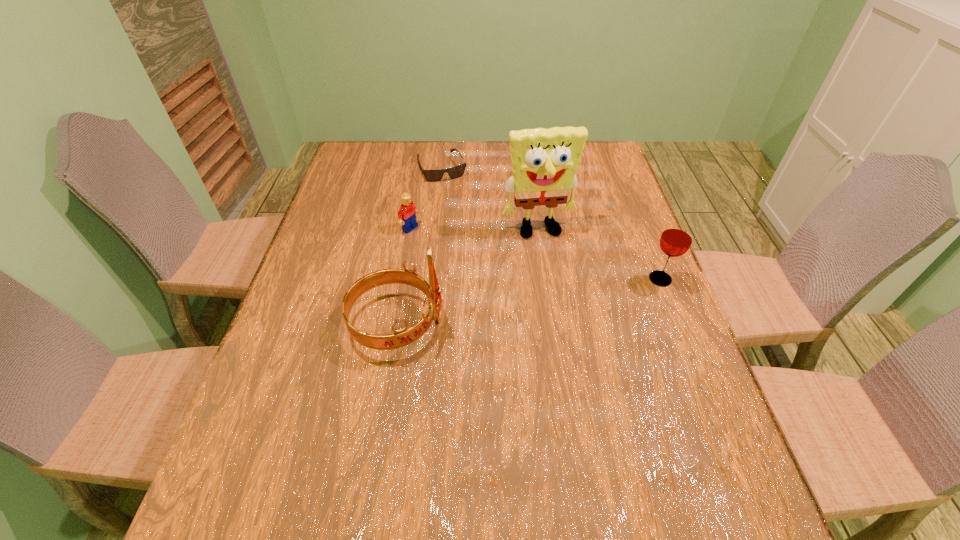
At what (x,y) coordinates should I click in order to perform the action: click on object present at the far edge. Please return your answer as a coordinate pair (x, y). The width and height of the screenshot is (960, 540). Looking at the image, I should click on (454, 172).

This screenshot has width=960, height=540. Find the location of `object that is at the left edge`. object that is at the left edge is located at coordinates (402, 337).

Find the location of a particular element. The width and height of the screenshot is (960, 540). object present at the right edge is located at coordinates (676, 239).

Where is `vacant space at the far edge`? This screenshot has height=540, width=960. vacant space at the far edge is located at coordinates (468, 161).

Find the location of `vacant point at the left edge`. vacant point at the left edge is located at coordinates (328, 247).

Where is `vacant space at the right edge of the desktop`? vacant space at the right edge of the desktop is located at coordinates (606, 251).

Find the location of a particular element. This screenshot has height=540, width=960. vacant space at the far left corner of the desktop is located at coordinates (378, 161).

Locate an element on the screen. empty space between the Lego and the sunglasses is located at coordinates (426, 198).

Locate an element on the screen. The image size is (960, 540). unoccupied position between the farthest object and the sponge is located at coordinates coord(491,199).

What are the coordinates of `vacant space that's between the tallest object and the fourth farthest object` in the screenshot? It's located at (599, 255).